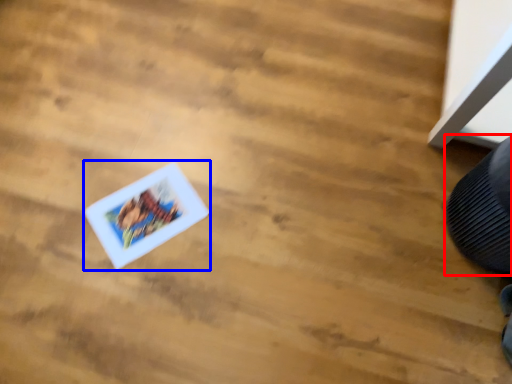
Question: Which object is further to the camera taking this photo, shoe (highlighted by a red box) or comic book (highlighted by a blue box)?

Choices:
 (A) shoe
 (B) comic book

Answer: (B)